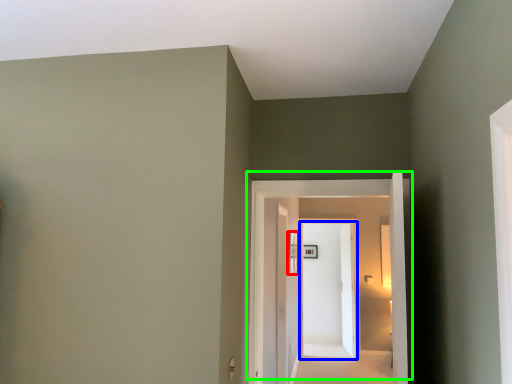
Question: Which object is the farthest from window (highlighted by a red box)? Choose among these: door (highlighted by a blue box) or door (highlighted by a green box).

Choices:
 (A) door
 (B) door

Answer: (A)